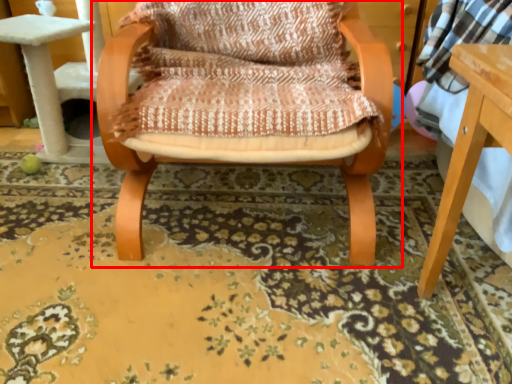
Question: In this image, where is chair (annotated by the red box) located relative to mat?

Choices:
 (A) right
 (B) left

Answer: (A)